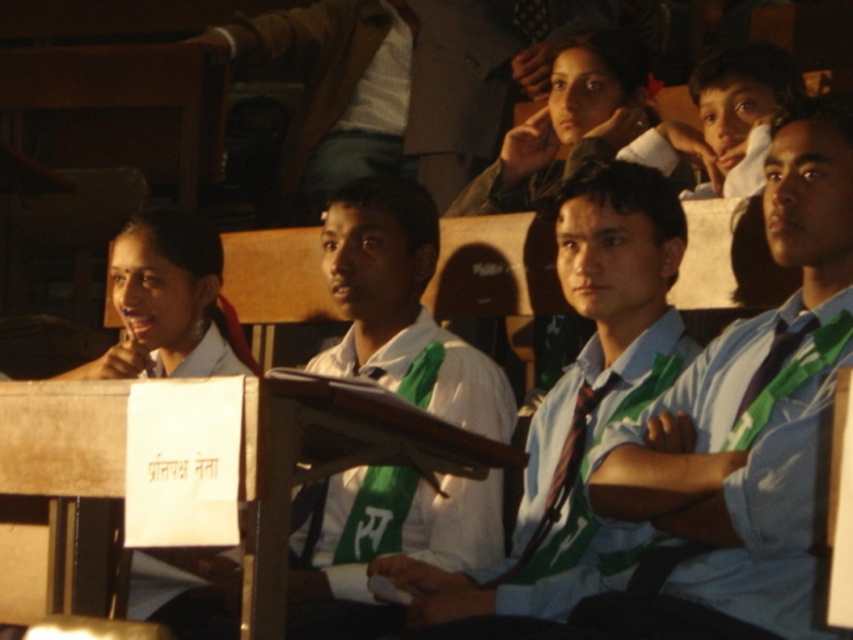
Question: Can you confirm if light blue shirt at center is positioned to the right of white shirt with green tie at center?

Choices:
 (A) yes
 (B) no

Answer: (A)

Question: Which of these objects is positioned closest to the light blue shirt at center?

Choices:
 (A) brown textured coat at upper center
 (B) white shirt with green tie at center

Answer: (B)

Question: Estimate the real-world distances between objects in this image. Which object is farther from the brown textured coat at upper center?

Choices:
 (A) light blue shirt at center
 (B) white shirt with green tie at center

Answer: (A)

Question: Is light blue shirt at center wider than brown textured coat at upper center?

Choices:
 (A) no
 (B) yes

Answer: (A)

Question: Which of the following is the farthest from the observer?

Choices:
 (A) (616, 216)
 (B) (431, 60)

Answer: (B)

Question: Can you confirm if white shirt with green tie at center is positioned above brown textured coat at upper center?

Choices:
 (A) no
 (B) yes

Answer: (A)